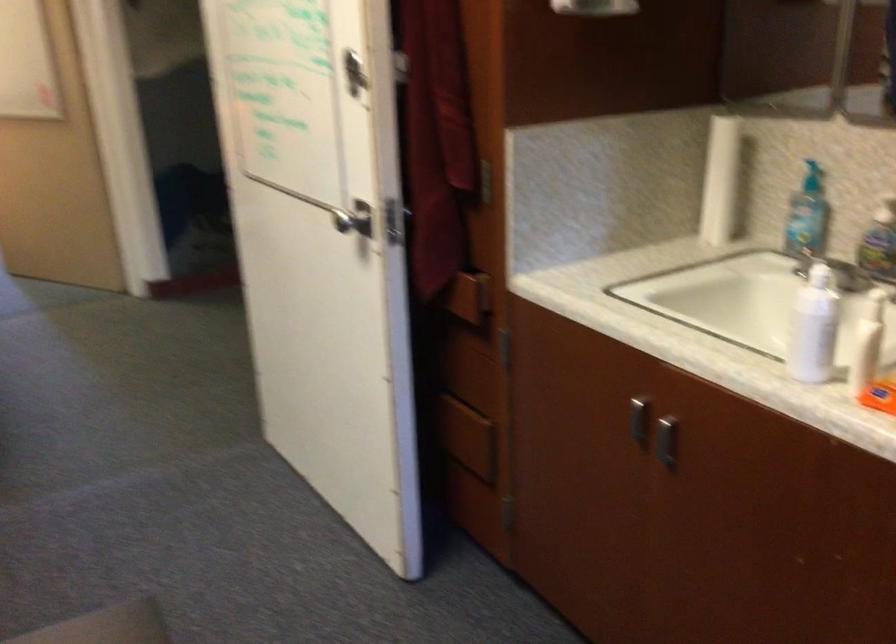
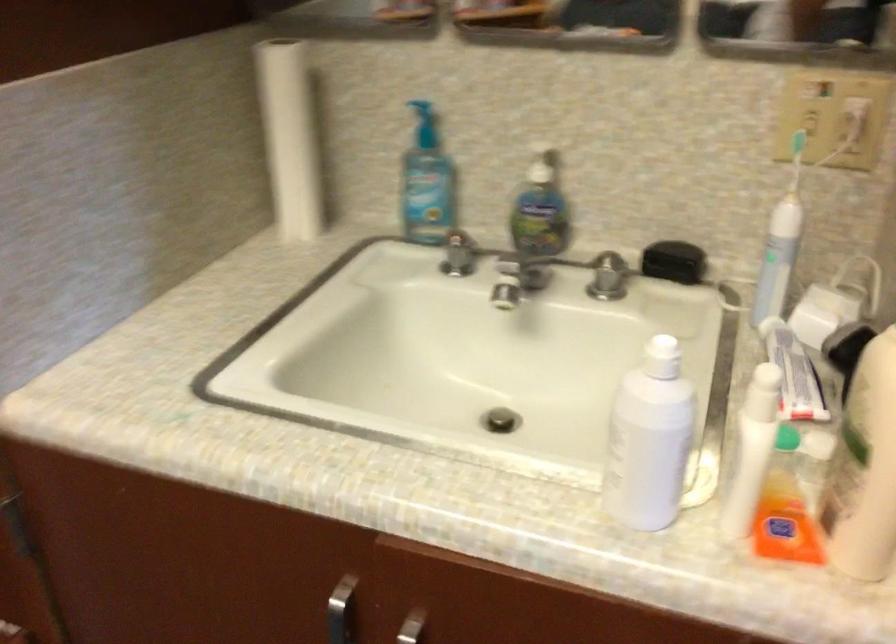
Locate, in the second image, the point that corresponds to the point at 806,162 in the first image.

(423, 109)